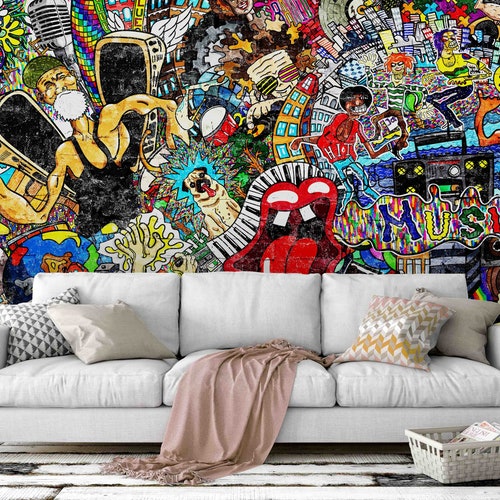
The height and width of the screenshot is (500, 500). What are the coordinates of `couch` in the screenshot? It's located at (228, 296).